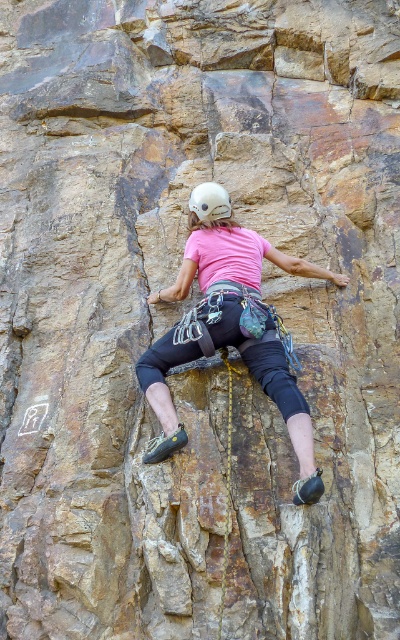
Question: Which object is farther from the camera taking this photo?

Choices:
 (A) white matte helmet at center
 (B) pink fabric shirt at center

Answer: (A)

Question: Is pink fabric shirt at center above white matte helmet at center?

Choices:
 (A) no
 (B) yes

Answer: (A)

Question: Which of the following is the farthest from the observer?

Choices:
 (A) 146,381
 (B) 218,186

Answer: (B)

Question: Is pink fabric shirt at center further to the viewer compared to white matte helmet at center?

Choices:
 (A) no
 (B) yes

Answer: (A)

Question: Among these objects, which one is farthest from the camera?

Choices:
 (A) white matte helmet at center
 (B) pink fabric shirt at center

Answer: (A)

Question: Considering the relative positions of pink fabric shirt at center and white matte helmet at center in the image provided, where is pink fabric shirt at center located with respect to white matte helmet at center?

Choices:
 (A) above
 (B) below

Answer: (B)